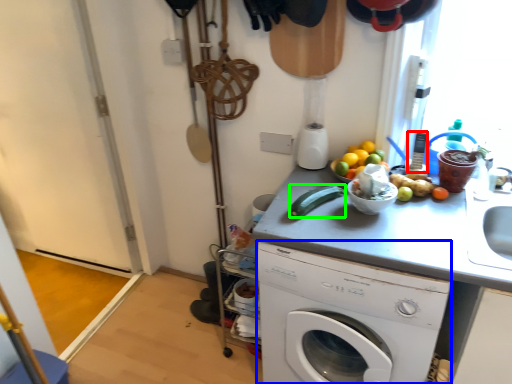
Question: Which object is the closest to the appliance (highlighted by a red box)? Choose among these: washing machine (highlighted by a blue box) or cucumber (highlighted by a green box).

Choices:
 (A) washing machine
 (B) cucumber

Answer: (B)